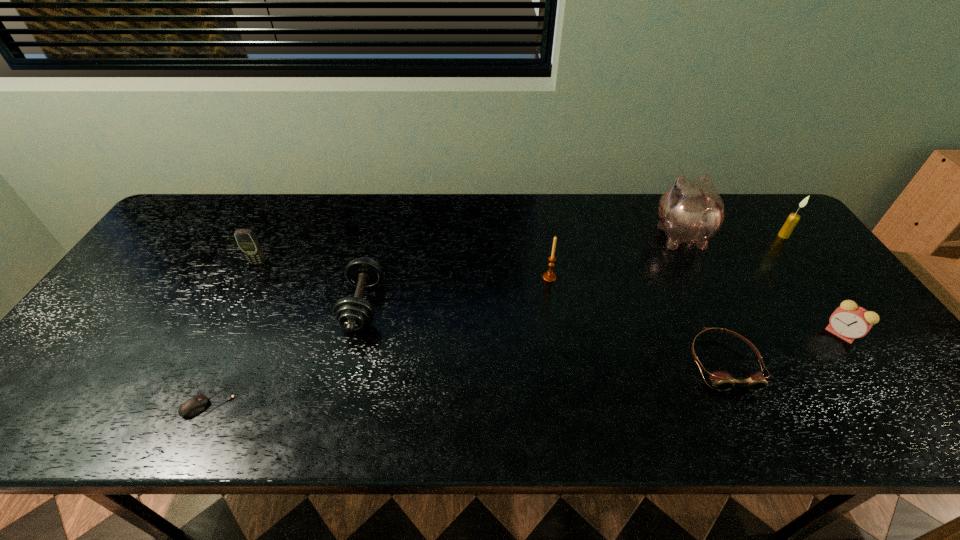
Identify the location of piggy bank that is at the far edge. (690, 211).

Locate an element on the screen. The height and width of the screenshot is (540, 960). candle that is at the far edge is located at coordinates (792, 220).

You are a GUI agent. You are given a task and a screenshot of the screen. Output one action in this format:
    pyautogui.click(x=<x>, y=<y>)
    Task: Click on the object situated at the near edge
    
    Given the screenshot: What is the action you would take?
    tap(196, 404)

Where is `candle situated at the right edge`? Image resolution: width=960 pixels, height=540 pixels. candle situated at the right edge is located at coordinates (792, 220).

Where is `alarm clock present at the right edge`? alarm clock present at the right edge is located at coordinates (849, 321).

In order to click on object at the far right corner in this screenshot , I will do `click(792, 220)`.

I want to click on vacant space at the far edge, so click(354, 202).

You are a GUI agent. You are given a task and a screenshot of the screen. Output one action in this format:
    pyautogui.click(x=<x>, y=<y>)
    Task: Click on the vacant area at the left edge
    The image size is (960, 540).
    Given the screenshot: What is the action you would take?
    pyautogui.click(x=48, y=384)

The image size is (960, 540). Find the location of `vacant space at the right edge of the desktop`. vacant space at the right edge of the desktop is located at coordinates (824, 291).

Identify the location of vacant space at the far left corner of the desktop. (218, 205).